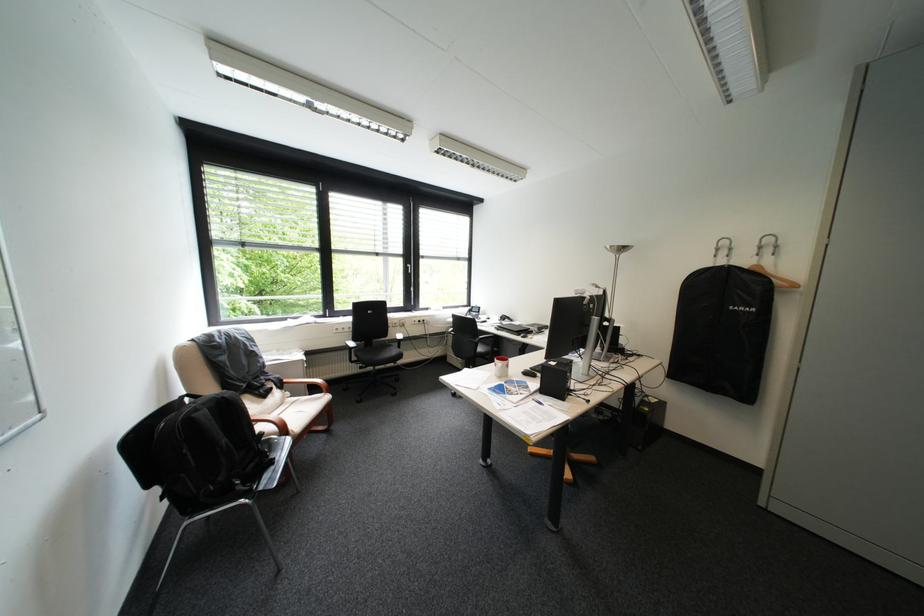
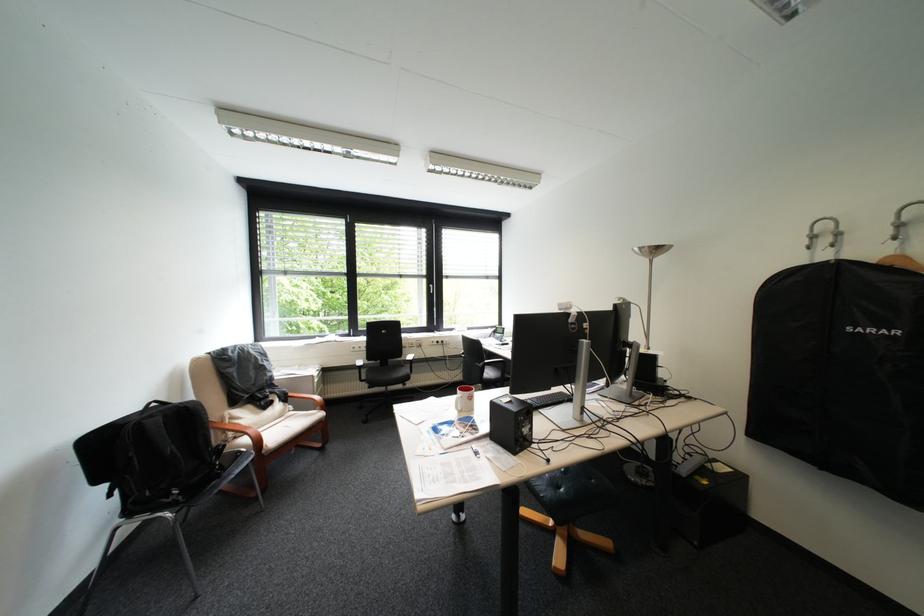
What movement of the cameraman would produce the second image?

The cameraman moved toward right, forward.